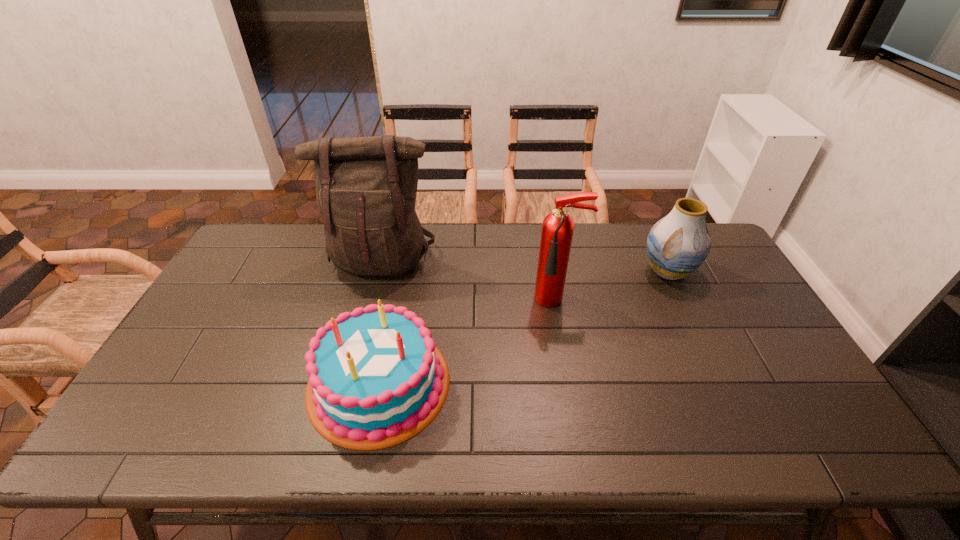
The image size is (960, 540). Find the location of `free space between the second tallest object and the backpack`. free space between the second tallest object and the backpack is located at coordinates (469, 281).

This screenshot has height=540, width=960. What are the coordinates of `empty space that is in between the vase and the backpack` in the screenshot? It's located at (525, 266).

Find the location of `free point between the nearest object and the second object from right to left`. free point between the nearest object and the second object from right to left is located at coordinates (468, 342).

This screenshot has width=960, height=540. In order to click on vacant space in between the backpack and the vase in this screenshot , I will do `click(525, 266)`.

I want to click on free area in between the birthday cake and the third shortest object, so click(x=468, y=342).

The width and height of the screenshot is (960, 540). Find the location of `free spot between the backpack and the rightmost object`. free spot between the backpack and the rightmost object is located at coordinates (525, 266).

At what (x,y) coordinates should I click in order to perform the action: click on empty space between the rightmost object and the nearest object. Please return your answer as a coordinate pair (x, y). Image resolution: width=960 pixels, height=540 pixels. Looking at the image, I should click on (523, 327).

Identify the location of blank region between the second tallest object and the vase. This screenshot has height=540, width=960. (612, 287).

Locate an element on the screen. This screenshot has height=540, width=960. unoccupied area between the tallest object and the rightmost object is located at coordinates coord(525,266).

Locate an element on the screen. The width and height of the screenshot is (960, 540). object that is the second closest one to the tallest object is located at coordinates (557, 231).